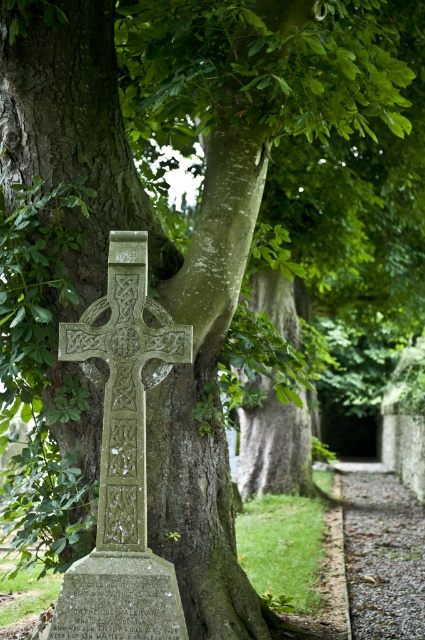
Who is positioned more to the left, green stone cross at center or granite gravestone at center?

Positioned to the left is granite gravestone at center.

Which is below, green stone cross at center or granite gravestone at center?

granite gravestone at center

Is point (132, 260) farther from camera compared to point (139, 582)?

Yes, point (132, 260) is farther from viewer.

Identify the location of green stone cross at center. The height and width of the screenshot is (640, 425). (124, 384).

Consider the image. Is gravel path at lower center to the right of granite gravestone at center from the viewer's perspective?

Correct, you'll find gravel path at lower center to the right of granite gravestone at center.

Between gravel path at lower center and granite gravestone at center, which one has less height?

Standing shorter between the two is gravel path at lower center.

I want to click on gravel path at lower center, so click(x=382, y=552).

Does green stone cross at center come in front of gravel path at lower center?

Yes, green stone cross at center is in front of gravel path at lower center.

Is green stone cross at center wider than gravel path at lower center?

Yes, green stone cross at center is wider than gravel path at lower center.

Between point (102, 536) and point (408, 525), which one is positioned behind?

Positioned behind is point (408, 525).

Locate an element on the screen. The height and width of the screenshot is (640, 425). green stone cross at center is located at coordinates (124, 384).